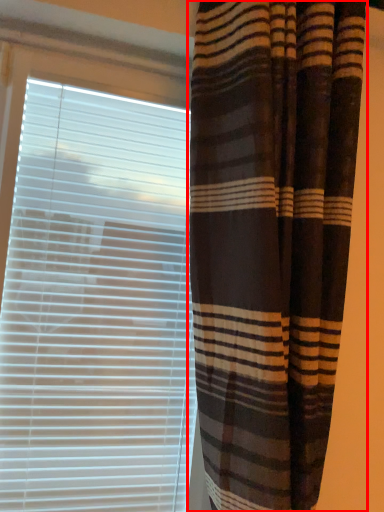
Question: From the image's perspective, where is curtain (annotated by the red box) located relative to window blind?

Choices:
 (A) below
 (B) above

Answer: (B)